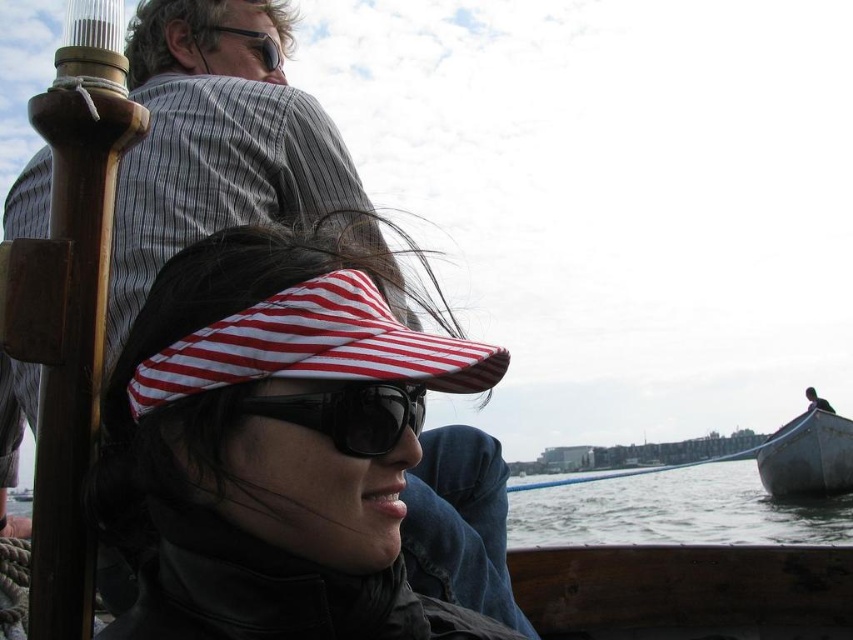
Based on the photo, you are a photographer on the boat and want to take a photo of the dark gray wooden boat at lower right without the black plastic sunglasses at center appearing in the frame. Is it possible to do so by moving the camera slightly backward?

The black plastic sunglasses at center is in front of the dark gray wooden boat at lower right. Since the sunglasses are closer to the camera, moving the camera backward might not remove them from the frame. You would need to adjust the angle or move sideways to exclude the sunglasses while keeping the boat in view.

You are a photographer on the boat and want to take a photo of the black plastic sunglasses at center and the dark gray wooden boat at lower right. To ensure both are in the frame, should you pan your camera to the left or right?

The black plastic sunglasses at center is to the left of dark gray wooden boat at lower right, so you should pan your camera to the left to include both in the frame.